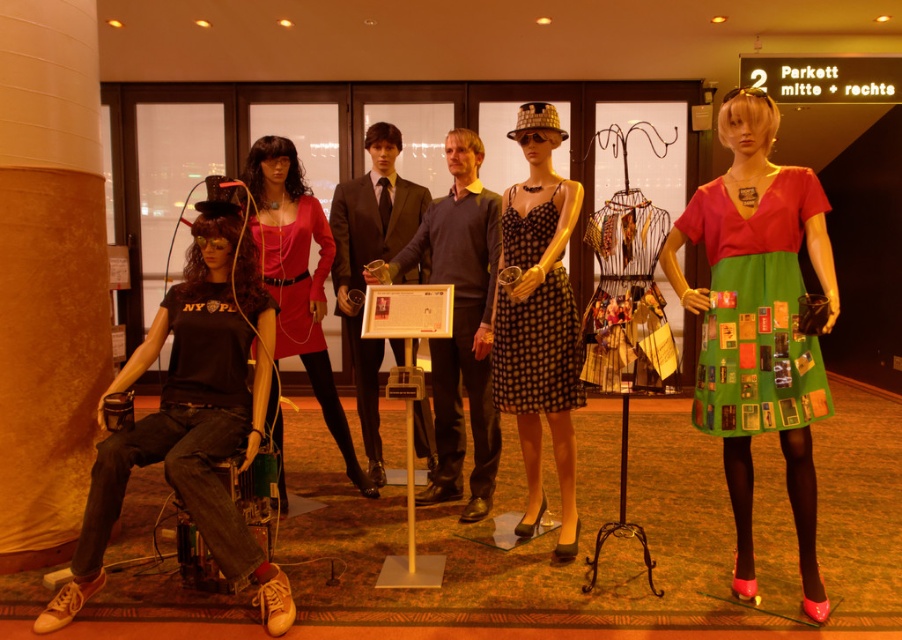
You are standing at the entrance of the display and want to walk towards the point labeled as point (827,285). Which direction should you go relative to point (246,164)?

Point (827,285) is in front of point (246,164), so you should walk towards the direction where point (827,285) is located, which is in front of point (246,164).